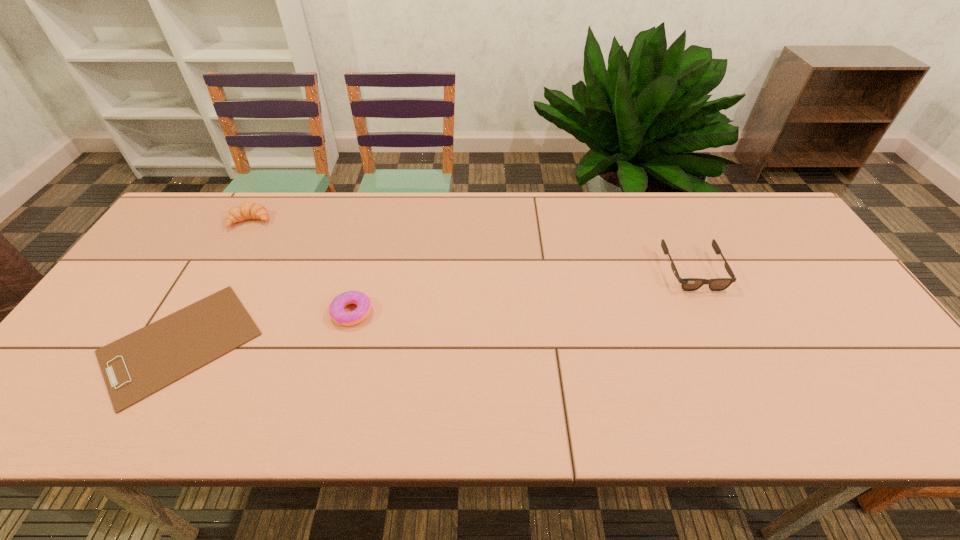
Where is `object located in the near edge section of the desktop`? Image resolution: width=960 pixels, height=540 pixels. object located in the near edge section of the desktop is located at coordinates (134, 367).

Where is `object situated at the left edge`? object situated at the left edge is located at coordinates (134, 367).

Find the location of a particular element. Image resolution: width=960 pixels, height=540 pixels. object situated at the near left corner is located at coordinates (134, 367).

Find the location of a particular element. The height and width of the screenshot is (540, 960). vacant region at the far edge is located at coordinates (504, 197).

In the image, there is a desktop. At what (x,y) coordinates should I click in order to perform the action: click on vacant space at the near edge. Please return your answer as a coordinate pair (x, y). Image resolution: width=960 pixels, height=540 pixels. Looking at the image, I should click on (274, 421).

In the image, there is a desktop. In order to click on free region at the left edge in this screenshot , I will do `click(49, 390)`.

Find the location of a particular element. vacant region at the right edge of the desktop is located at coordinates (831, 310).

The height and width of the screenshot is (540, 960). Identify the location of free region at the far left corner of the desktop. (221, 224).

The height and width of the screenshot is (540, 960). What are the coordinates of `vacant region at the near right corner of the desktop` in the screenshot? It's located at (861, 393).

Image resolution: width=960 pixels, height=540 pixels. Identify the location of free space between the clipboard and the sunglasses. (437, 307).